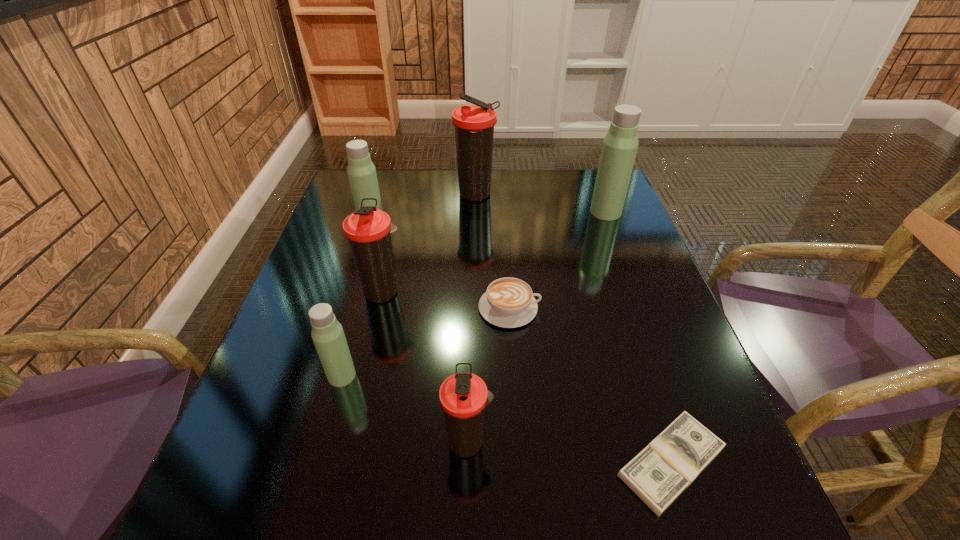
Where is `the seventh closest object to the second biggest light thermos bottle`? This screenshot has height=540, width=960. the seventh closest object to the second biggest light thermos bottle is located at coordinates (660, 472).

Identify which object is the third closest to the shortest object. Please provide its 2D coordinates. Your answer should be formatted as a tuple, i.e. [(x, y)], where the tuple contains the x and y coordinates of a point satisfying the conditions above.

[(328, 336)]

Identify which thermos bottle is the closest to the shortest object. Please provide its 2D coordinates. Your answer should be formatted as a tuple, i.e. [(x, y)], where the tuple contains the x and y coordinates of a point satisfying the conditions above.

[(463, 396)]

Where is `thermos bottle that is the fifth closest to the farthest brown thermos bottle`? thermos bottle that is the fifth closest to the farthest brown thermos bottle is located at coordinates click(463, 396).

Identify which brown thermos bottle is the closest to the cappuccino. Please provide its 2D coordinates. Your answer should be formatted as a tuple, i.e. [(x, y)], where the tuple contains the x and y coordinates of a point satisfying the conditions above.

[(368, 230)]

This screenshot has width=960, height=540. Identify the location of brown thermos bottle identified as the third closest to the second biggest light thermos bottle. (463, 396).

The image size is (960, 540). What are the coordinates of `light thermos bottle that stands as the closest to the third nearest thermos bottle` in the screenshot? It's located at click(x=328, y=336).

Locate which light thermos bottle is the second closest to the biggest light thermos bottle. Please provide its 2D coordinates. Your answer should be formatted as a tuple, i.e. [(x, y)], where the tuple contains the x and y coordinates of a point satisfying the conditions above.

[(328, 336)]

The width and height of the screenshot is (960, 540). I want to click on vacant space that satisfies the following two spatial constraints: 1. on the side of the cappuccino with the handle; 2. on the left side of the dollar, so click(520, 463).

This screenshot has width=960, height=540. Find the location of `vacant region that satisfies the following two spatial constraints: 1. on the front side of the second biggest light thermos bottle; 2. on the right side of the nearest thermos bottle`. vacant region that satisfies the following two spatial constraints: 1. on the front side of the second biggest light thermos bottle; 2. on the right side of the nearest thermos bottle is located at coordinates pyautogui.click(x=304, y=442).